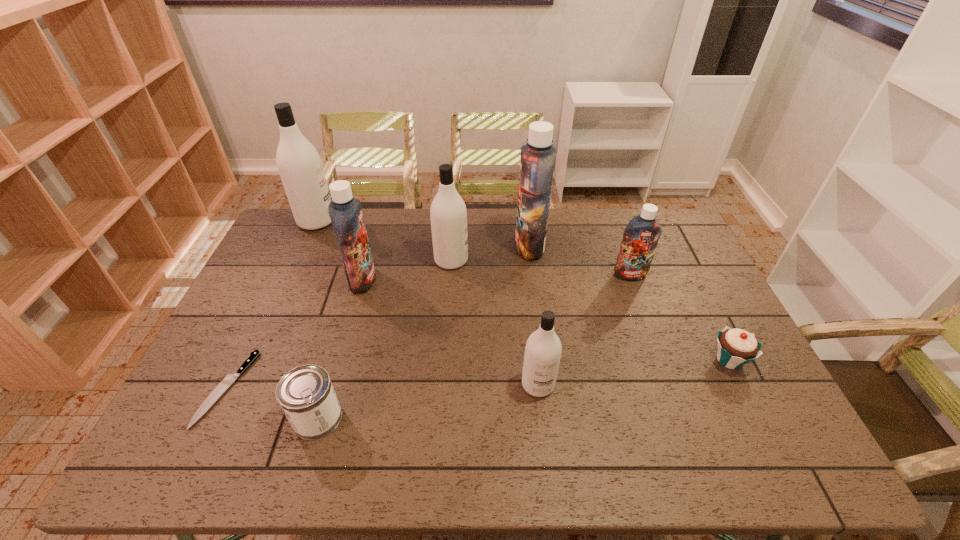
This screenshot has height=540, width=960. What are the coordinates of `vacant space located on the front label of the second smallest blue shampoo` in the screenshot? It's located at (493, 280).

Where is `vacant area situated 0.180m on the front-facing side of the second biggest white shampoo`? vacant area situated 0.180m on the front-facing side of the second biggest white shampoo is located at coordinates 520,260.

Where is `vacant position located 0.390m on the front label of the rightmost blue shampoo`? Image resolution: width=960 pixels, height=540 pixels. vacant position located 0.390m on the front label of the rightmost blue shampoo is located at coordinates (669, 383).

Locate an element on the screen. This screenshot has width=960, height=540. vacant region located 0.080m on the front-facing side of the smallest white shampoo is located at coordinates (543, 428).

You are a GUI agent. You are given a task and a screenshot of the screen. Output one action in this format:
    pyautogui.click(x=<x>, y=<y>)
    Task: Click on the vacant region located 0.390m on the back of the can
    The height and width of the screenshot is (540, 960).
    Given the screenshot: What is the action you would take?
    pyautogui.click(x=355, y=290)

This screenshot has width=960, height=540. Find the location of `vacant space situated 0.300m on the left of the second shortest object`. vacant space situated 0.300m on the left of the second shortest object is located at coordinates coord(600,360).

At what (x,y) coordinates should I click in order to perform the action: click on free spot located 0.130m on the right of the shortest object. Please return your answer as a coordinate pair (x, y). Looking at the image, I should click on (295, 389).

In order to click on object positioned at the near edge in this screenshot , I will do `click(306, 395)`.

Find the location of a particular element. The image size is (960, 540). shampoo that is at the left edge is located at coordinates (299, 164).

The width and height of the screenshot is (960, 540). I want to click on steak knife that is at the left edge, so click(229, 378).